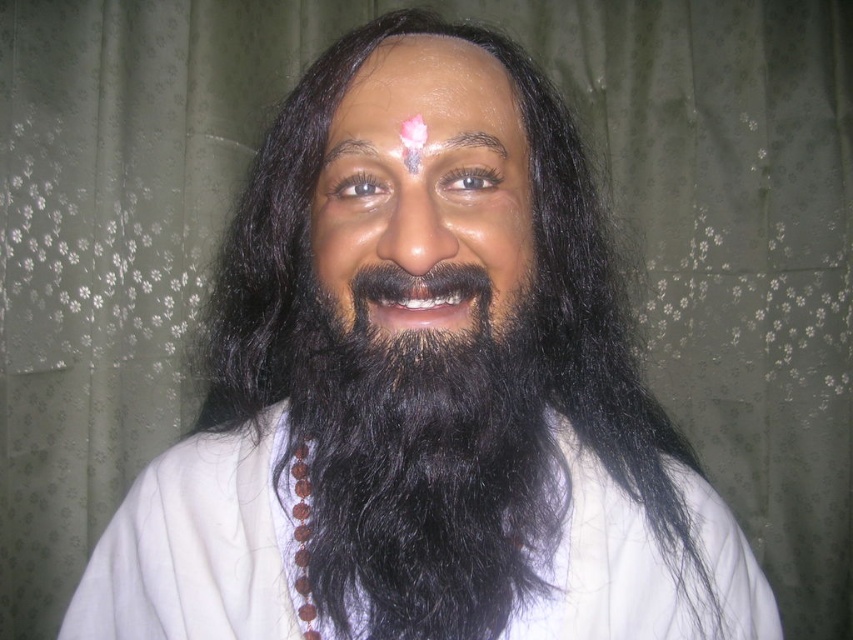
You are standing in front of the image and want to place a small offering on the white cloth at center. Based on the scene description, where exactly should you place it?

The white cloth at center is located at point (198,545), so you should place the offering at those coordinates.

Based on the scene description, is the white cloth at center wider than the smooth skin face at center?

The white cloth at center might be wider than smooth skin face at center according to the description.